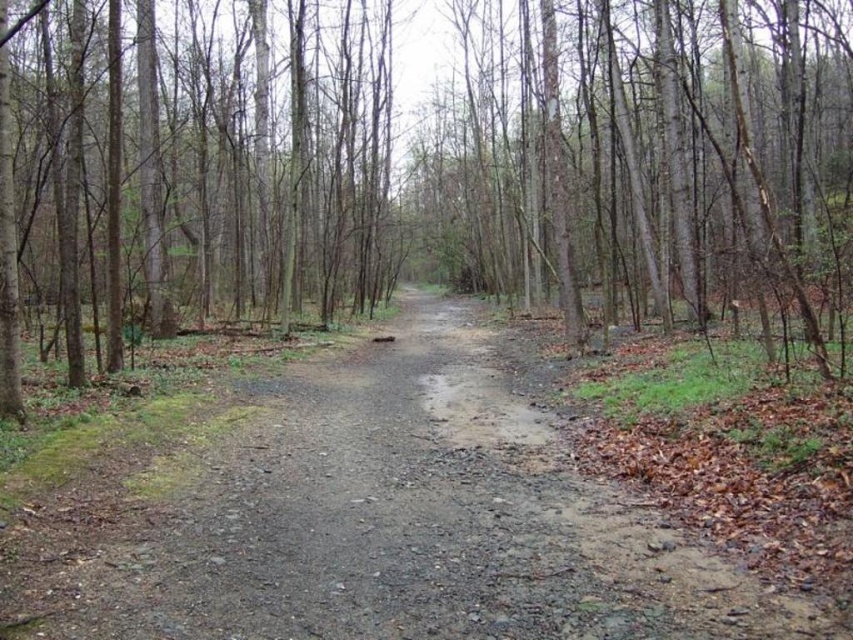
Question: Can you confirm if brown bark tree at center is thinner than gray gravel path at center?

Choices:
 (A) no
 (B) yes

Answer: (A)

Question: Which of the following is the closest to the observer?

Choices:
 (A) (589, 86)
 (B) (134, 627)

Answer: (B)

Question: Which object appears farthest from the camera in this image?

Choices:
 (A) brown bark tree at center
 (B) gray gravel path at center

Answer: (A)

Question: Considering the relative positions of brown bark tree at center and gray gravel path at center in the image provided, where is brown bark tree at center located with respect to gray gravel path at center?

Choices:
 (A) below
 (B) above

Answer: (B)

Question: Does brown bark tree at center have a lesser width compared to gray gravel path at center?

Choices:
 (A) yes
 (B) no

Answer: (B)